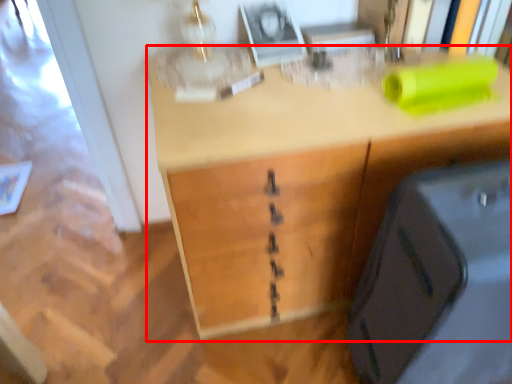
Question: From the image's perspective, considering the relative positions of desk (annotated by the red box) and luggage in the image provided, where is desk (annotated by the red box) located with respect to the staircase?

Choices:
 (A) above
 (B) below

Answer: (A)